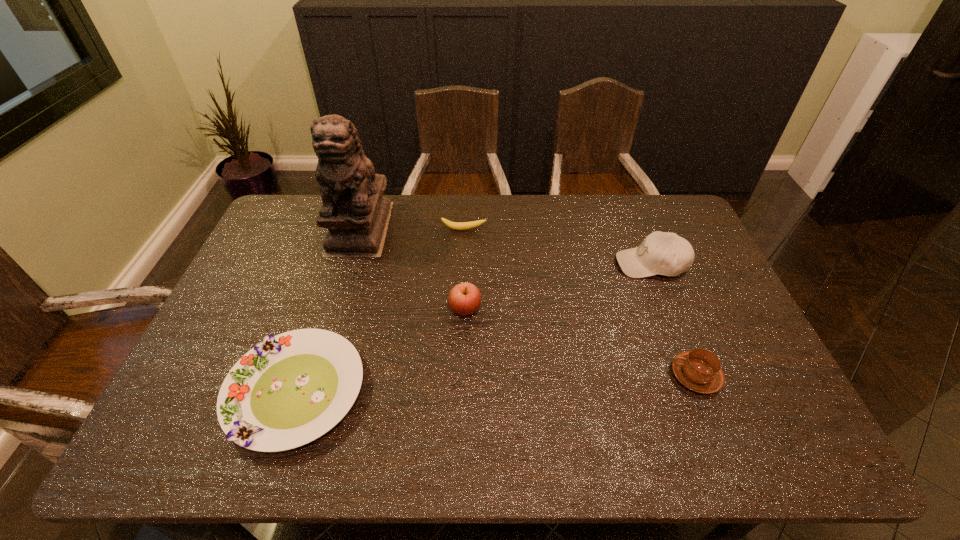
Where is `the tallest object`? Image resolution: width=960 pixels, height=540 pixels. the tallest object is located at coordinates (355, 212).

At what (x,y) coordinates should I click in order to perform the action: click on the second tallest object. Please return your answer as a coordinate pair (x, y). This screenshot has width=960, height=540. Looking at the image, I should click on (665, 253).

You are a GUI agent. You are given a task and a screenshot of the screen. Output one action in this format:
    pyautogui.click(x=<x>, y=<y>)
    Task: Click on the fourth farthest object
    The height and width of the screenshot is (540, 960).
    Given the screenshot: What is the action you would take?
    pyautogui.click(x=464, y=299)

The image size is (960, 540). I want to click on the third tallest object, so click(464, 299).

This screenshot has height=540, width=960. I want to click on the fourth tallest object, so click(699, 370).

This screenshot has width=960, height=540. What are the coordinates of `banana` in the screenshot? It's located at (x=453, y=225).

The image size is (960, 540). What are the coordinates of `salad plate` in the screenshot? It's located at (289, 390).

Find the location of a particular element. The height and width of the screenshot is (540, 960). free space located 0.190m on the front-facing side of the sculpture is located at coordinates (338, 301).

I want to click on vacant region located 0.310m on the front-facing side of the second tallest object, so click(x=519, y=264).

This screenshot has height=540, width=960. Find the location of `free region located 0.070m on the front-facing side of the second tallest object`. free region located 0.070m on the front-facing side of the second tallest object is located at coordinates (594, 264).